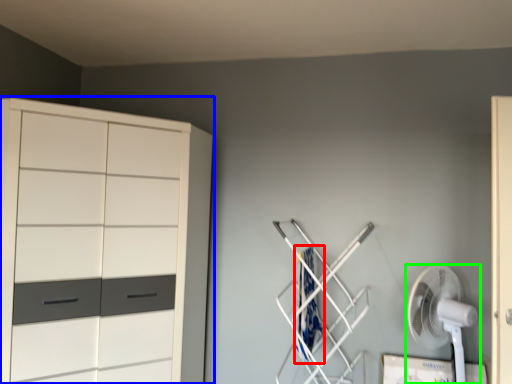
Question: Which object is positioned farthest from laundry (highlighted by a red box)? Select from cupboard (highlighted by a blue box) and mechanical fan (highlighted by a green box).

Choices:
 (A) cupboard
 (B) mechanical fan

Answer: (A)